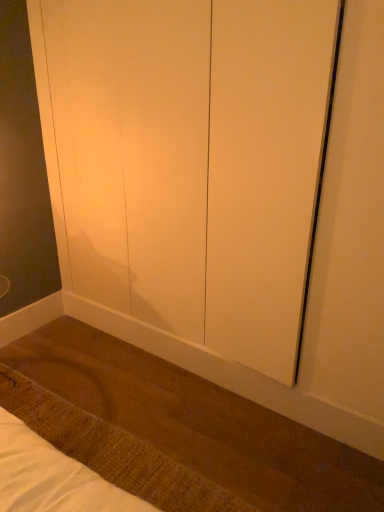
Find the location of `free point above brown woven mat at lower left (from a real-world perspective)`. free point above brown woven mat at lower left (from a real-world perspective) is located at coordinates (106, 445).